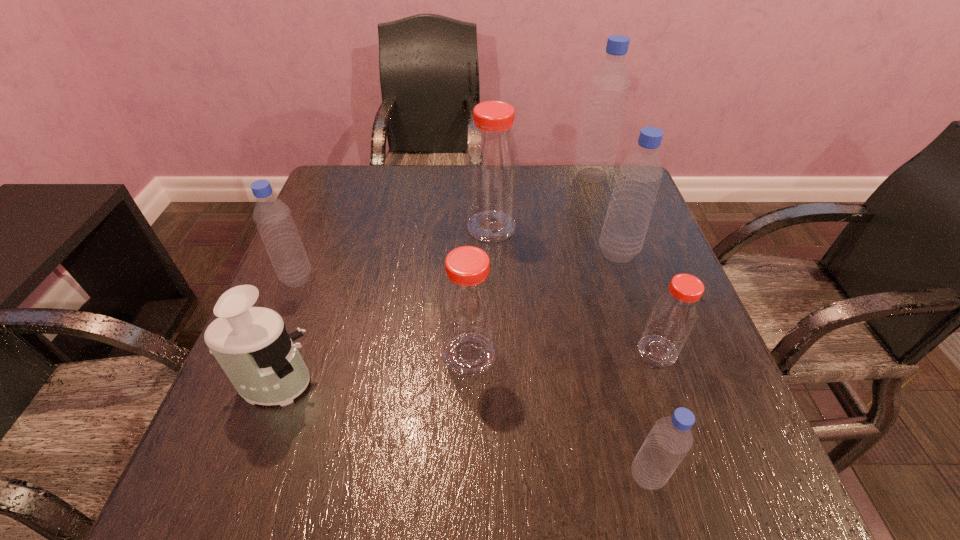
Where is `the nearest bottle`? the nearest bottle is located at coordinates (670, 439).

The width and height of the screenshot is (960, 540). I want to click on vacant region located on the left of the tallest bottle, so click(494, 176).

Find the location of a particular element. The width and height of the screenshot is (960, 540). vacant space situated on the left of the biggest red bottle is located at coordinates (442, 227).

I want to click on vacant point located 0.090m on the left of the third smallest blue bottle, so click(x=558, y=253).

This screenshot has width=960, height=540. In order to click on free spot located 0.200m on the back of the leftmost blue bottle in this screenshot , I will do `click(324, 212)`.

The height and width of the screenshot is (540, 960). In order to click on free location located 0.150m on the left of the second smallest red bottle in this screenshot , I will do `click(362, 355)`.

Find the location of a particular element. This screenshot has height=540, width=960. vacant space positioned on the front of the juicer is located at coordinates (x=235, y=490).

You are a GUI agent. You are given a task and a screenshot of the screen. Output one action in this format:
    pyautogui.click(x=<x>, y=<y>)
    Task: Click on the vacant space located 0.130m on the back of the rightmost red bottle
    The height and width of the screenshot is (540, 960).
    Given the screenshot: What is the action you would take?
    pyautogui.click(x=635, y=286)

Identify the location of free space located on the back of the nearest bottle. The image size is (960, 540). (623, 384).

You are a GUI agent. You are given a task and a screenshot of the screen. Output one action in this format:
    pyautogui.click(x=<x>, y=<y>)
    Task: Click on the object that is at the near edge
    This screenshot has height=540, width=960.
    Given the screenshot: What is the action you would take?
    pyautogui.click(x=670, y=439)